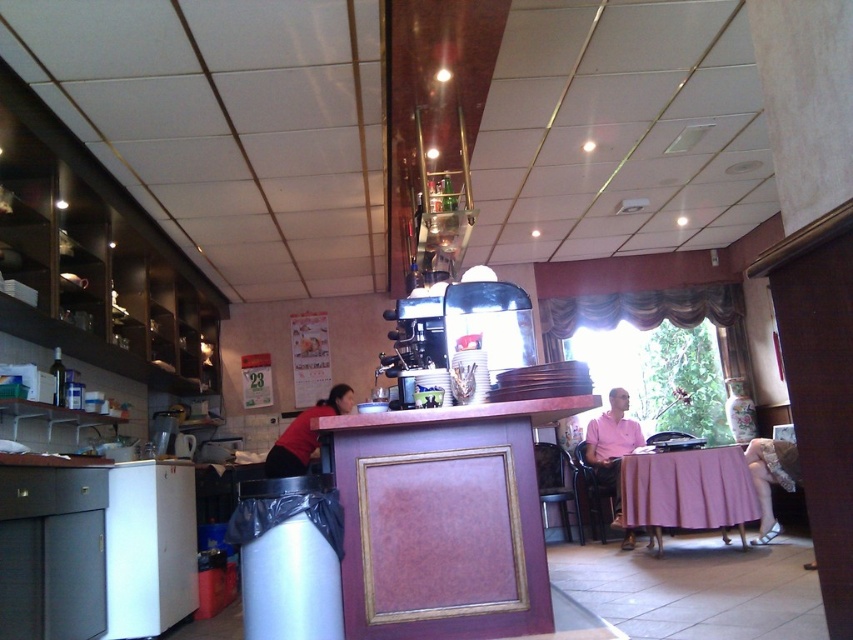
Is pink fabric table at lower right shorter than red shirt at counter?

No, pink fabric table at lower right is not shorter than red shirt at counter.

Can you confirm if pink fabric table at lower right is positioned above red shirt at counter?

No.

In order to click on pink fabric table at lower right in this screenshot , I will do `click(688, 490)`.